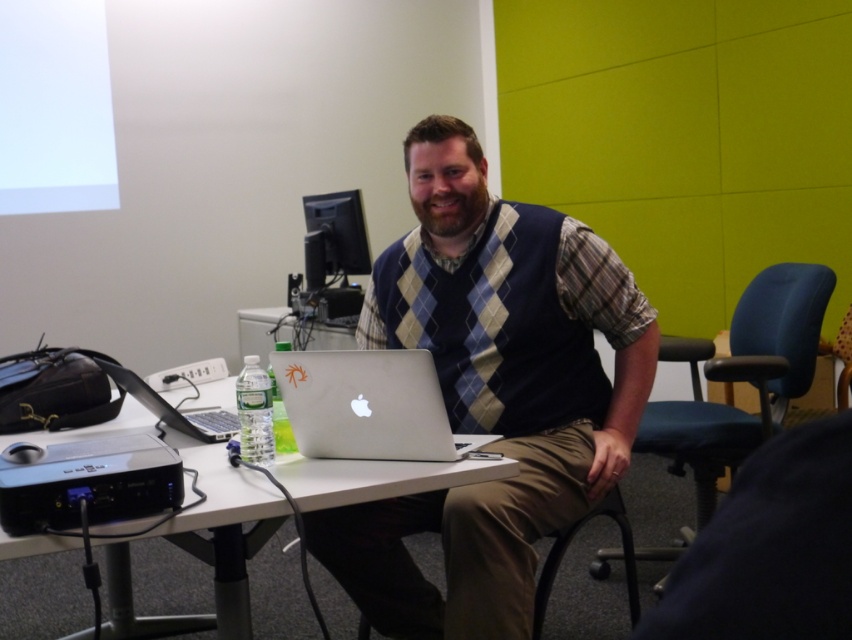
Can you confirm if dark blue fabric at lower right is wider than silver metallic laptop at center?

In fact, dark blue fabric at lower right might be narrower than silver metallic laptop at center.

Is dark blue fabric at lower right below silver metallic laptop at center?

No, dark blue fabric at lower right is not below silver metallic laptop at center.

This screenshot has height=640, width=852. What do you see at coordinates (770, 547) in the screenshot?
I see `dark blue fabric at lower right` at bounding box center [770, 547].

Locate an element on the screen. The width and height of the screenshot is (852, 640). dark blue fabric at lower right is located at coordinates (770, 547).

Find the location of a particular element. Image resolution: width=852 pixels, height=640 pixels. knit sweater vest at center is located at coordinates [492, 392].

Identify the location of knit sweater vest at center. This screenshot has height=640, width=852. (492, 392).

Can you confirm if blue fabric swivel chair at right is thinner than black plastic projector at lower left?

Incorrect, blue fabric swivel chair at right's width is not less than black plastic projector at lower left's.

This screenshot has height=640, width=852. Find the location of `blue fabric swivel chair at right`. blue fabric swivel chair at right is located at coordinates (741, 380).

Where is `blue fabric swivel chair at right`? The image size is (852, 640). blue fabric swivel chair at right is located at coordinates (741, 380).